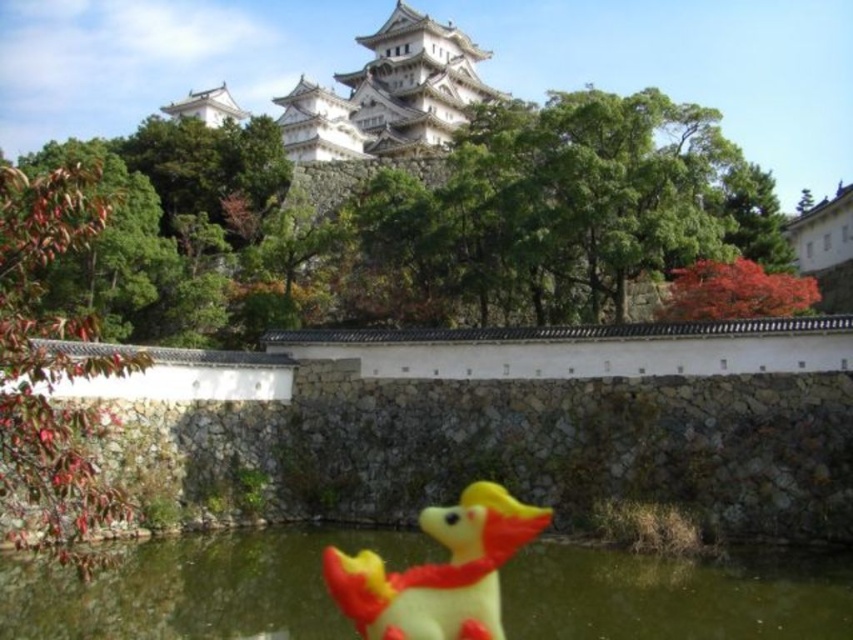
Can you confirm if translucent plastic water at center is bigger than yellow rubber duck at lower center?

Yes, translucent plastic water at center is bigger than yellow rubber duck at lower center.

Based on the photo, is translucent plastic water at center in front of yellow rubber duck at lower center?

Yes.

Who is more forward, (126, 554) or (485, 528)?

Point (126, 554) is in front.

The height and width of the screenshot is (640, 853). Identify the location of translucent plastic water at center. (195, 586).